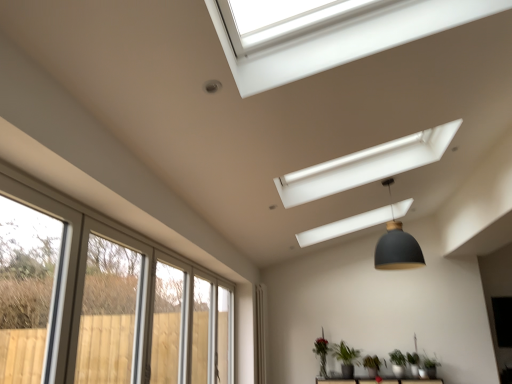
Identify the location of green matte plant at lower center, the 4th plant viewed from the left. This screenshot has width=512, height=384. (397, 358).

The width and height of the screenshot is (512, 384). Describe the element at coordinates (397, 358) in the screenshot. I see `green matte plant at lower center, the 1th plant viewed from the right` at that location.

What do you see at coordinates (167, 324) in the screenshot? This screenshot has width=512, height=384. I see `clear glass screen door at lower left` at bounding box center [167, 324].

What is the approximate width of green matte plant at lower center, arranged as the 3th plant when viewed from the left?

15.18 inches.

Identify the location of green matte plant at lower center, which is counted as the 1th plant, starting from the left. (321, 354).

You are a GUI agent. You are given a task and a screenshot of the screen. Output one action in this format:
    pyautogui.click(x=<x>, y=<y>)
    Task: Click on the matte black pendant lamp at center
    
    Given the screenshot: What is the action you would take?
    pyautogui.click(x=397, y=245)

Locate an element on the screen. The width and height of the screenshot is (512, 384). green matte plant at lower center, the 4th plant viewed from the left is located at coordinates (397, 358).

From a real-world perspective, is matte black pendant lamp at center beneath green matte plant at lower center, the 4th plant viewed from the left?

No.

From the image's perspective, which one is positioned higher, matte black pendant lamp at center or green matte plant at lower center, the 4th plant viewed from the left?

matte black pendant lamp at center appears higher in the image.

Would you say matte black pendant lamp at center is inside or outside green matte plant at lower center, the 4th plant viewed from the left?

matte black pendant lamp at center is not enclosed by green matte plant at lower center, the 4th plant viewed from the left.

Is green matte plant at lower center, which is counted as the 1th plant, starting from the left, located within green matte plant at lower center, the 2th plant in the left-to-right sequence?

No, green matte plant at lower center, which is counted as the 1th plant, starting from the left, is not inside green matte plant at lower center, the 2th plant in the left-to-right sequence.

Is there a large distance between green matte plant at lower center, the third plant from the right, and green matte plant at lower center, the fourth plant from the right?

green matte plant at lower center, the third plant from the right, is near green matte plant at lower center, the fourth plant from the right, not far away.

Can you confirm if green matte plant at lower center, the 2th plant in the left-to-right sequence, is shorter than green matte plant at lower center, which is counted as the 1th plant, starting from the left?

Indeed, green matte plant at lower center, the 2th plant in the left-to-right sequence, has a lesser height compared to green matte plant at lower center, which is counted as the 1th plant, starting from the left.

From the image's perspective, who appears lower, green matte plant at lower center, the third plant from the right, or green matte plant at lower center, which is counted as the 1th plant, starting from the left?

green matte plant at lower center, which is counted as the 1th plant, starting from the left, is shown below in the image.

Measure the distance from matte black pendant lamp at center to green matte plant at lower center, which is counted as the 1th plant, starting from the left.

A distance of 7.84 feet exists between matte black pendant lamp at center and green matte plant at lower center, which is counted as the 1th plant, starting from the left.

Looking at their sizes, would you say matte black pendant lamp at center is wider or thinner than green matte plant at lower center, which is counted as the 1th plant, starting from the left?

matte black pendant lamp at center is wider than green matte plant at lower center, which is counted as the 1th plant, starting from the left.

Would you say matte black pendant lamp at center is to the left or to the right of green matte plant at lower center, the fourth plant from the right, in the picture?

Based on their positions, matte black pendant lamp at center is located to the right of green matte plant at lower center, the fourth plant from the right.

Are matte black pendant lamp at center and green matte plant at lower center, the fourth plant from the right, beside each other?

No, matte black pendant lamp at center is not making contact with green matte plant at lower center, the fourth plant from the right.

Which point is more forward, (397,362) or (173,333)?

The point (173,333) is closer.

Based on the photo, from the image's perspective, which one is positioned lower, green matte plant at lower center, the 4th plant viewed from the left, or clear glass screen door at lower left?

green matte plant at lower center, the 4th plant viewed from the left.

In the scene shown: Is green matte plant at lower center, the 1th plant viewed from the right, looking in the opposite direction of clear glass screen door at lower left?

No, green matte plant at lower center, the 1th plant viewed from the right,'s orientation is not away from clear glass screen door at lower left.

From the picture: Considering the positions of objects green matte plant at lower center, the 4th plant viewed from the left, and clear glass screen door at lower left in the image provided, who is more to the left, green matte plant at lower center, the 4th plant viewed from the left, or clear glass screen door at lower left?

clear glass screen door at lower left is more to the left.

From the image's perspective, which is below, matte black pendant lamp at center or white fabric curtain at lower center?

white fabric curtain at lower center appears lower in the image.

How far apart are matte black pendant lamp at center and white fabric curtain at lower center?

The distance of matte black pendant lamp at center from white fabric curtain at lower center is 2.45 meters.

Is matte black pendant lamp at center oriented away from white fabric curtain at lower center?

That's not correct — matte black pendant lamp at center is not looking away from white fabric curtain at lower center.

Between matte black pendant lamp at center and white fabric curtain at lower center, which one has larger size?

Bigger between the two is matte black pendant lamp at center.

From the image's perspective, is green matte plant at lower center, the third plant from the right, under green matte plant at lower center, arranged as the 3th plant when viewed from the left?

No, from the image's perspective, green matte plant at lower center, the third plant from the right, is not beneath green matte plant at lower center, arranged as the 3th plant when viewed from the left.

From a real-world perspective, is green matte plant at lower center, the third plant from the right, over green matte plant at lower center, arranged as the 3th plant when viewed from the left?

Correct, in the physical world, green matte plant at lower center, the third plant from the right, is higher than green matte plant at lower center, arranged as the 3th plant when viewed from the left.

This screenshot has width=512, height=384. Find the location of `the 1st plant behind when counting from the green matte plant at lower center, the third plant from the right`. the 1st plant behind when counting from the green matte plant at lower center, the third plant from the right is located at coordinates (372, 365).

Between green matte plant at lower center, the third plant from the right, and green matte plant at lower center, arranged as the 3th plant when viewed from the left, which one is positioned behind?

green matte plant at lower center, arranged as the 3th plant when viewed from the left, is further away from the camera.

Considering the relative sizes of green matte plant at lower center, which is counted as the 1th plant, starting from the left, and matte black pendant lamp at center in the image provided, is green matte plant at lower center, which is counted as the 1th plant, starting from the left, thinner than matte black pendant lamp at center?

Indeed, green matte plant at lower center, which is counted as the 1th plant, starting from the left, has a lesser width compared to matte black pendant lamp at center.

Which is correct: green matte plant at lower center, which is counted as the 1th plant, starting from the left, is inside matte black pendant lamp at center, or outside of it?

green matte plant at lower center, which is counted as the 1th plant, starting from the left, exists outside the volume of matte black pendant lamp at center.

Is green matte plant at lower center, the fourth plant from the right, to the left of matte black pendant lamp at center from the viewer's perspective?

Indeed, green matte plant at lower center, the fourth plant from the right, is positioned on the left side of matte black pendant lamp at center.

From the image's perspective, which one is positioned higher, green matte plant at lower center, the fourth plant from the right, or matte black pendant lamp at center?

matte black pendant lamp at center is shown above in the image.

I want to click on light fixture in front of the green matte plant at lower center, the 4th plant viewed from the left, so click(x=397, y=245).

The height and width of the screenshot is (384, 512). Identify the location of the 2nd plant above the green matte plant at lower center, which is counted as the 1th plant, starting from the left (from the image's perspective). (345, 354).

Estimate the real-world distances between objects in this image. Which object is further from white fabric curtain at lower center, green matte plant at lower center, marked as the second plant in a right-to-left arrangement, or clear glass screen door at lower left?

clear glass screen door at lower left is positioned further to the anchor white fabric curtain at lower center.

Which object lies further to the anchor point clear glass screen door at lower left, green matte plant at lower center, arranged as the 3th plant when viewed from the left, or white fabric curtain at lower center?

Based on the image, green matte plant at lower center, arranged as the 3th plant when viewed from the left, appears to be further to clear glass screen door at lower left.

Estimate the real-world distances between objects in this image. Which object is closer to white fabric curtain at lower center, green matte plant at lower center, arranged as the 3th plant when viewed from the left, or matte black pendant lamp at center?

green matte plant at lower center, arranged as the 3th plant when viewed from the left.

From the image, which object appears to be farther from matte black pendant lamp at center, green matte plant at lower center, which is counted as the 1th plant, starting from the left, or clear glass screen door at lower left?

Among the two, green matte plant at lower center, which is counted as the 1th plant, starting from the left, is located further to matte black pendant lamp at center.

Considering their positions, is green matte plant at lower center, marked as the second plant in a right-to-left arrangement, positioned further to green matte plant at lower center, which is counted as the 1th plant, starting from the left, than matte black pendant lamp at center?

The object further to green matte plant at lower center, which is counted as the 1th plant, starting from the left, is matte black pendant lamp at center.

Based on their spatial positions, is green matte plant at lower center, the fourth plant from the right, or green matte plant at lower center, marked as the second plant in a right-to-left arrangement, further from green matte plant at lower center, the 2th plant in the left-to-right sequence?

The object further to green matte plant at lower center, the 2th plant in the left-to-right sequence, is green matte plant at lower center, marked as the second plant in a right-to-left arrangement.

Looking at the image, which one is located closer to green matte plant at lower center, the fourth plant from the right, green matte plant at lower center, the 4th plant viewed from the left, or white fabric curtain at lower center?

Among the two, white fabric curtain at lower center is located nearer to green matte plant at lower center, the fourth plant from the right.

Considering their positions, is white fabric curtain at lower center positioned further to matte black pendant lamp at center than clear glass screen door at lower left?

white fabric curtain at lower center lies further to matte black pendant lamp at center than the other object.

At what (x,y) coordinates should I click in order to perform the action: click on light fixture positioned between clear glass screen door at lower left and green matte plant at lower center, the 4th plant viewed from the left, from near to far. Please return your answer as a coordinate pair (x, y). Looking at the image, I should click on coord(397,245).

Identify the location of light fixture between clear glass screen door at lower left and green matte plant at lower center, which is counted as the 1th plant, starting from the left, along the z-axis. Image resolution: width=512 pixels, height=384 pixels. (397, 245).

Identify the location of curtain located between matte black pendant lamp at center and green matte plant at lower center, the fourth plant from the right, in the depth direction. (260, 333).

Find the location of a particular element. This screenshot has height=384, width=512. plant between matte black pendant lamp at center and green matte plant at lower center, the 1th plant viewed from the right, vertically is located at coordinates pos(345,354).